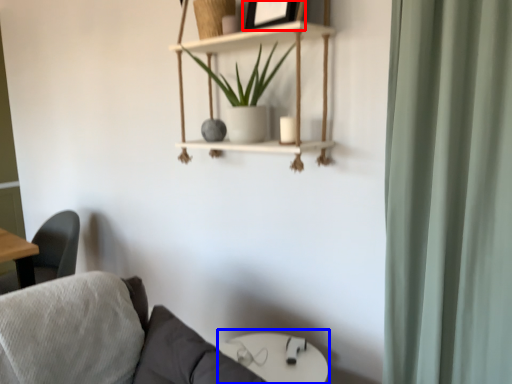
Question: Which object is closer to the camera taking this photo, picture frame (highlighted by a red box) or round table (highlighted by a blue box)?

Choices:
 (A) picture frame
 (B) round table

Answer: (A)